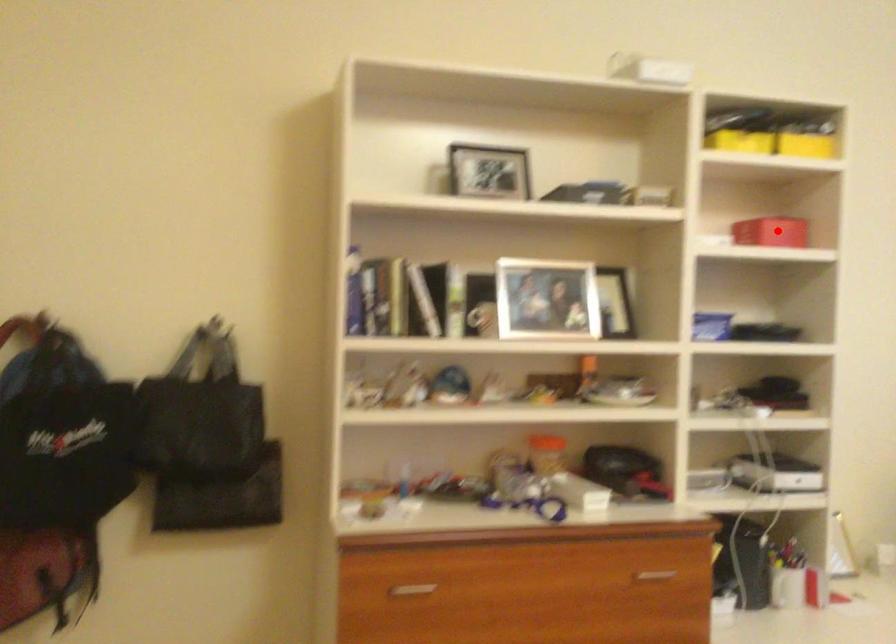
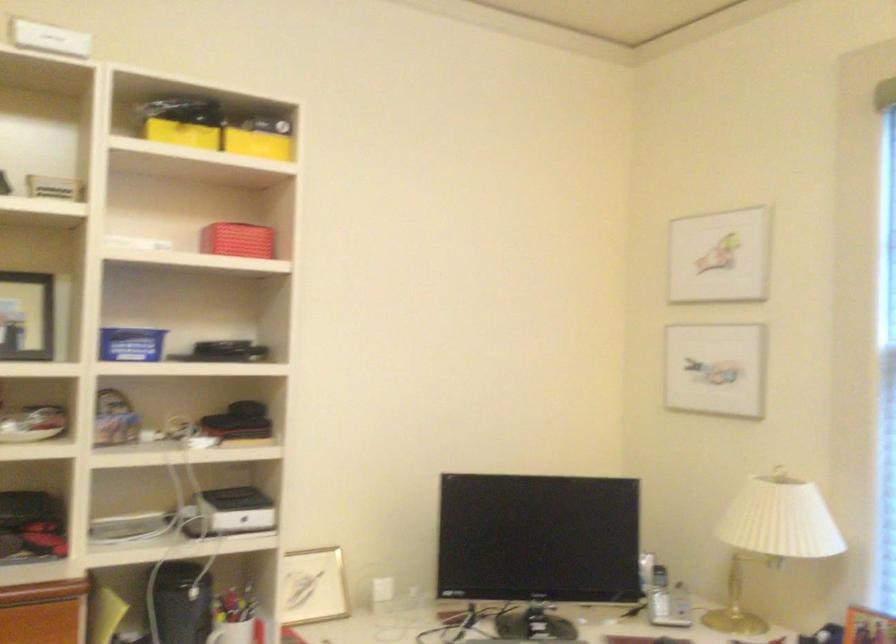
Question: I am providing you with two images of the same scene from different viewpoints. A red point is shown in image1. For the corresponding object point in image2, is it positioned nearer or farther from the camera?

Choices:
 (A) Nearer
 (B) Farther

Answer: (A)